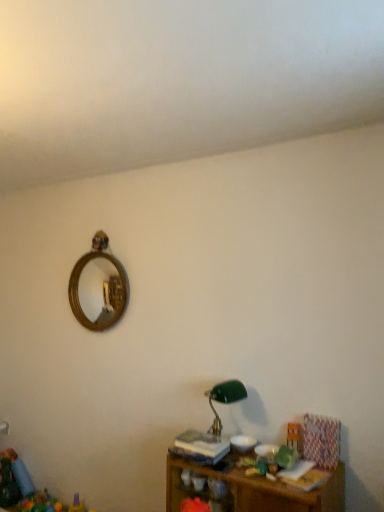
Question: Is green glass table lamp at lower center positioned beyond the bounds of wooden shelf at lower right?

Choices:
 (A) yes
 (B) no

Answer: (A)

Question: Is green glass table lamp at lower center closer to the viewer compared to wooden shelf at lower right?

Choices:
 (A) no
 (B) yes

Answer: (A)

Question: Is the surface of green glass table lamp at lower center in direct contact with wooden shelf at lower right?

Choices:
 (A) yes
 (B) no

Answer: (B)

Question: From the image's perspective, is green glass table lamp at lower center beneath wooden shelf at lower right?

Choices:
 (A) no
 (B) yes

Answer: (A)

Question: Is green glass table lamp at lower center behind wooden shelf at lower right?

Choices:
 (A) no
 (B) yes

Answer: (B)

Question: Is wooden toy at lower right taller or shorter than green glass table lamp at lower center?

Choices:
 (A) short
 (B) tall

Answer: (A)

Question: Is point (291, 423) positioned closer to the camera than point (236, 389)?

Choices:
 (A) farther
 (B) closer

Answer: (B)

Question: Is wooden toy at lower right bigger or smaller than green glass table lamp at lower center?

Choices:
 (A) big
 (B) small

Answer: (B)

Question: Relative to green glass table lamp at lower center, is wooden toy at lower right in front or behind?

Choices:
 (A) front
 (B) behind

Answer: (B)

Question: Considering their positions, is green glass table lamp at lower center located in front of or behind wooden toy at lower right?

Choices:
 (A) front
 (B) behind

Answer: (A)

Question: From a real-world perspective, is green glass table lamp at lower center above or below wooden toy at lower right?

Choices:
 (A) above
 (B) below

Answer: (A)

Question: Is point (236, 385) closer or farther from the camera than point (291, 437)?

Choices:
 (A) closer
 (B) farther

Answer: (B)

Question: Visually, is green glass table lamp at lower center positioned to the left or to the right of wooden toy at lower right?

Choices:
 (A) right
 (B) left

Answer: (B)

Question: In the image, is wooden toy at lower right positioned in front of or behind wooden shelf at lower right?

Choices:
 (A) behind
 (B) front

Answer: (A)

Question: Is point (291, 440) positioned closer to the camera than point (173, 492)?

Choices:
 (A) farther
 (B) closer

Answer: (A)